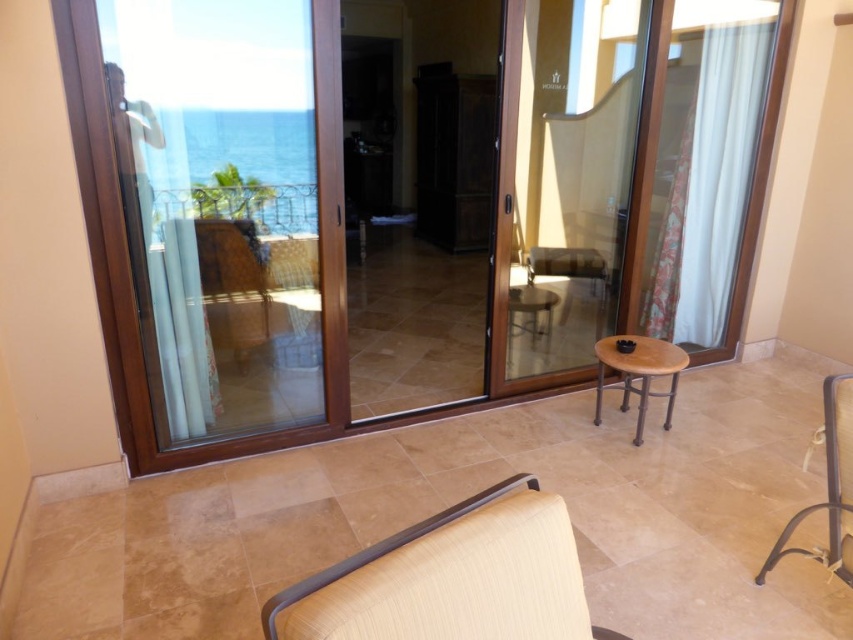
Is point (630, 378) farther from viewer compared to point (538, 324)?

No, (630, 378) is closer to viewer.

Describe the element at coordinates (637, 372) in the screenshot. Image resolution: width=853 pixels, height=640 pixels. I see `brown wooden stool at center` at that location.

I want to click on brown wooden stool at center, so click(x=637, y=372).

Can you confirm if beige fabric armchair at lower center is positioned to the left of metallic wrought iron railing at upper left?

Incorrect, beige fabric armchair at lower center is not on the left side of metallic wrought iron railing at upper left.

Is beige fabric armchair at lower center thinner than metallic wrought iron railing at upper left?

Incorrect, beige fabric armchair at lower center's width is not less than metallic wrought iron railing at upper left's.

Between point (328, 570) and point (260, 202), which one is positioned in front?

Point (328, 570)

The image size is (853, 640). I want to click on beige fabric armchair at lower center, so click(451, 579).

Can you confirm if beige fabric armchair at lower center is thinner than brown wooden stool at center?

No.

From the picture: Can you confirm if beige fabric armchair at lower center is smaller than brown wooden stool at center?

Yes, beige fabric armchair at lower center is smaller than brown wooden stool at center.

Does point (480, 520) lie in front of point (641, 378)?

Yes, point (480, 520) is in front of point (641, 378).

The width and height of the screenshot is (853, 640). I want to click on beige fabric armchair at lower center, so click(x=451, y=579).